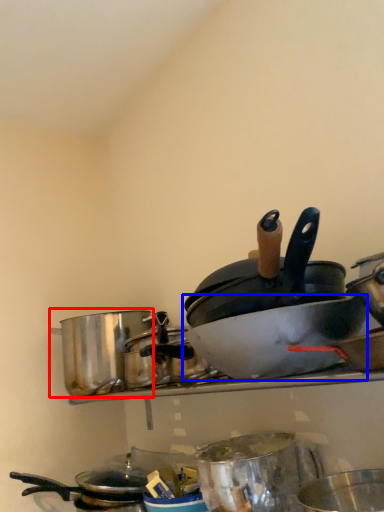
Question: Which of the following is the farthest to the observer, crock pot (highlighted by a red box) or basin (highlighted by a blue box)?

Choices:
 (A) crock pot
 (B) basin

Answer: (A)